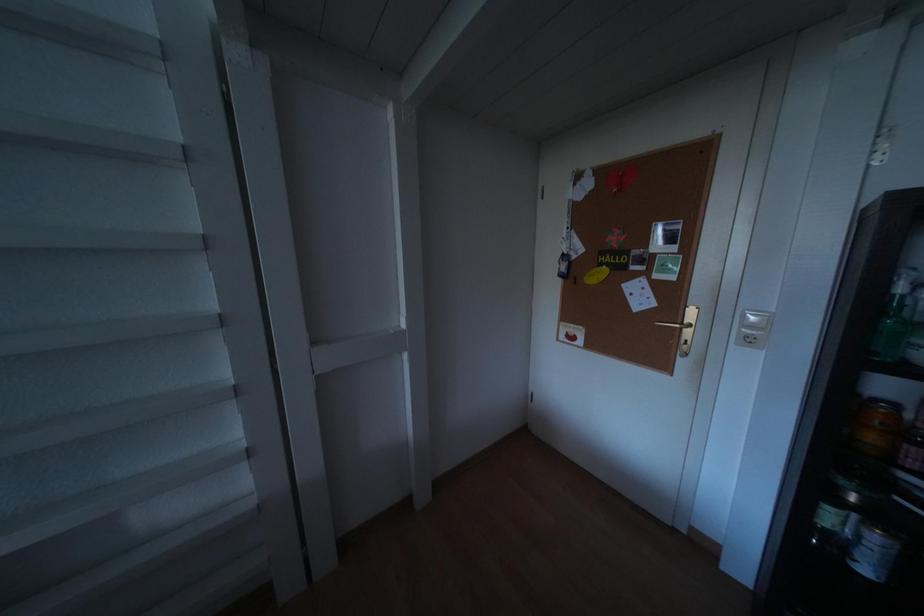
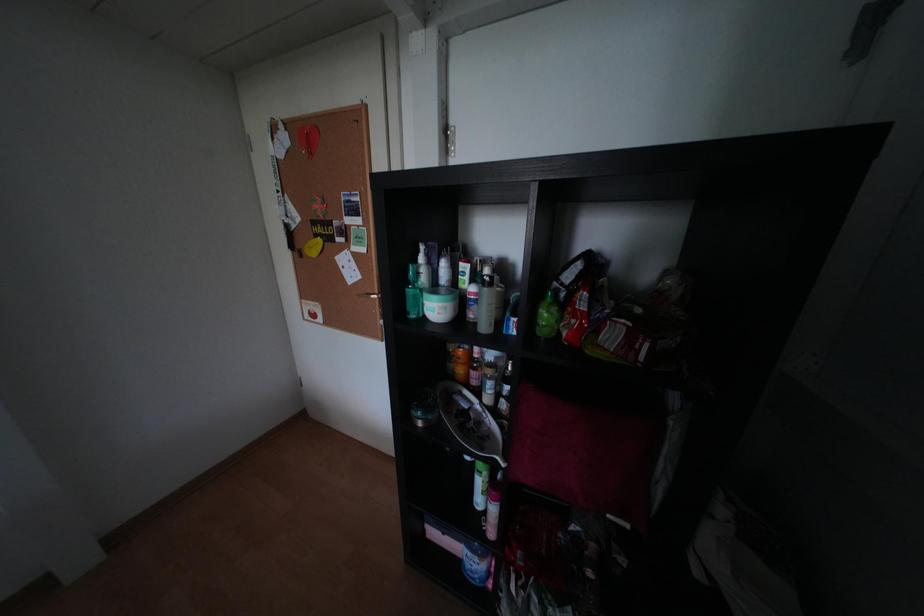
Question: Which direction would the cameraman need to move to produce the second image? Reply with the corresponding letter.

Choices:
 (A) Left
 (B) Right
 (C) Forward
 (D) Backward

Answer: (B)